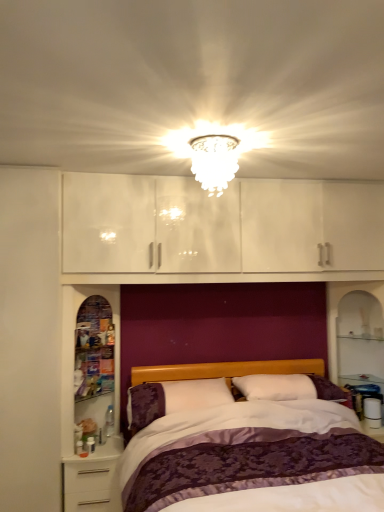
Question: Does point (x=145, y=406) appear closer or farther from the camera than point (x=311, y=476)?

Choices:
 (A) farther
 (B) closer

Answer: (A)

Question: Is white soft pillow at center situated inside purple satin bed at center or outside?

Choices:
 (A) outside
 (B) inside

Answer: (B)

Question: Estimate the real-world distances between objects in this image. Which object is farther from the white glossy nightstand at lower left?

Choices:
 (A) white soft pillow at center
 (B) transparent glass cabinet at left
 (C) purple satin bed at center
 (D) white glass chandelier at upper center

Answer: (D)

Question: Which is farther from the white glass chandelier at upper center?

Choices:
 (A) white soft pillow at center
 (B) transparent glass cabinet at left
 (C) purple satin bed at center
 (D) white glossy nightstand at lower left

Answer: (D)